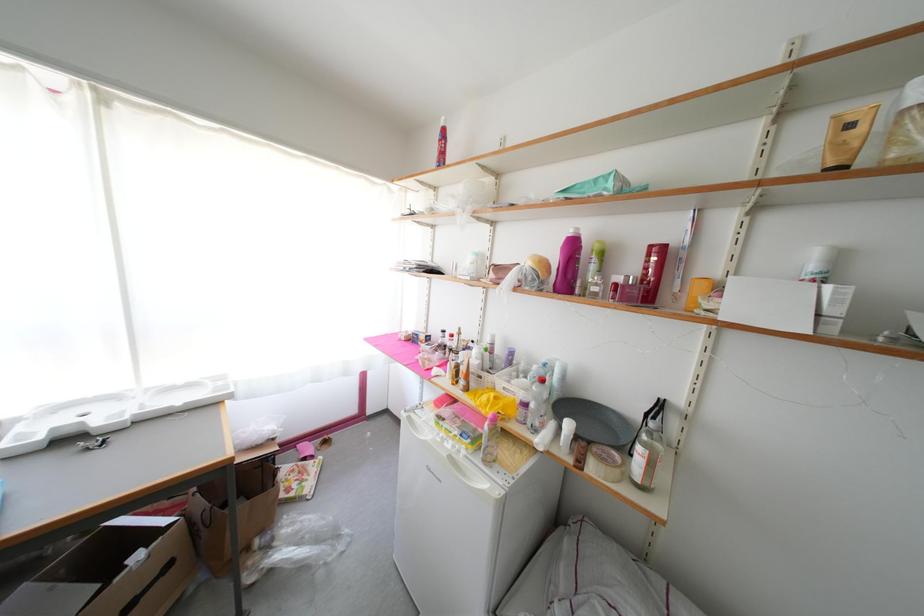
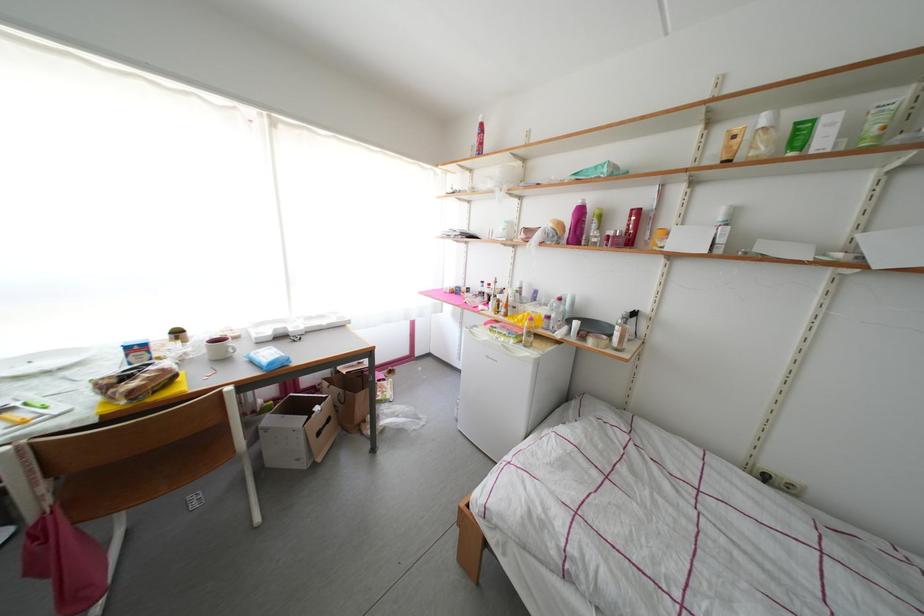
In a continuous first-person perspective shot, in which direction is the camera moving?

The movement direction of the cameraman is left, backward.